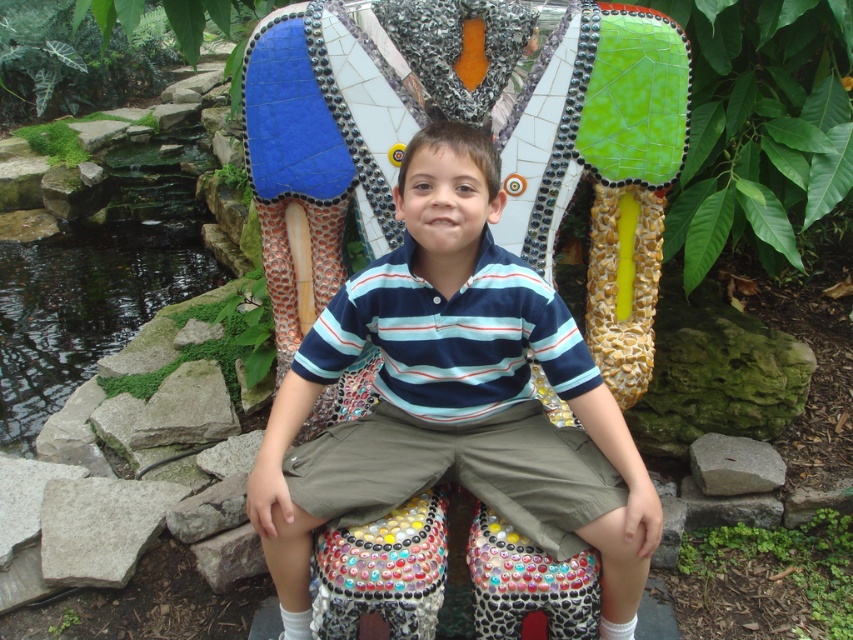
You are a photographer trying to capture the striped cotton shirt at center and the green mossy rocks at left in the same frame. Based on their positions, which object should you adjust your camera to focus on first if you want to include both in your shot?

The striped cotton shirt at center is to the right of the green mossy rocks at left. To include both in the frame, you should focus on the green mossy rocks at left first since it is on the left side, allowing you to pan towards the right to include the striped cotton shirt at center in the shot.

In the scene shown: Based on the scene description, where is the striped cotton shirt at center positioned in relation to the elephant sculpture?

The striped cotton shirt at center is located at point 0.620 on the x axis and 0.533 on the y axis.